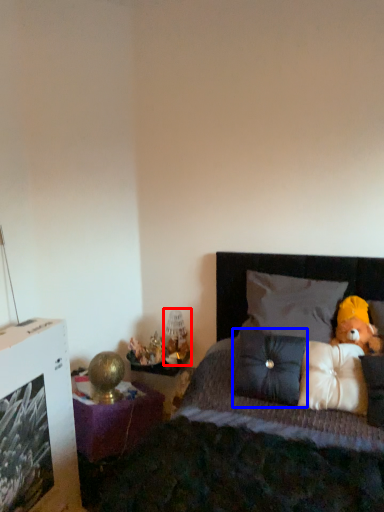
Question: Which object is closer to the camera taking this photo, table lamp (highlighted by a red box) or pillow (highlighted by a blue box)?

Choices:
 (A) table lamp
 (B) pillow

Answer: (B)